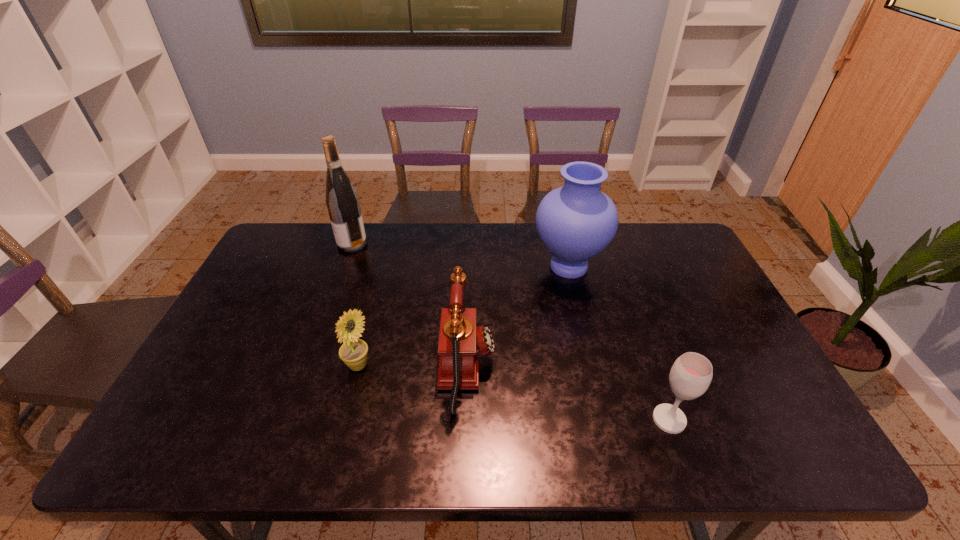
The image size is (960, 540). In order to click on free location at the near right corner of the desktop in this screenshot , I will do `click(766, 451)`.

The image size is (960, 540). I want to click on free spot between the wineglass and the vase, so click(x=619, y=343).

Identify the location of vacant space that's between the wine bottle and the vase. (461, 255).

Locate an element on the screen. free space between the wine bottle and the third tallest object is located at coordinates (409, 306).

This screenshot has height=540, width=960. What are the coordinates of `vacant area between the sunflower and the wine bottle` in the screenshot? It's located at (355, 305).

I want to click on free point between the wineglass and the second object from left to right, so click(x=514, y=393).

Locate an element on the screen. vacant point located between the third object from right to left and the leftmost object is located at coordinates (409, 306).

This screenshot has height=540, width=960. What are the coordinates of `free space between the telephone and the second object from left to right` in the screenshot? It's located at (413, 368).

Identify the location of free space between the wineglass and the wine bottle. (511, 332).

Find the location of `vacant region between the wineglass and the telephone`. vacant region between the wineglass and the telephone is located at coordinates (568, 394).